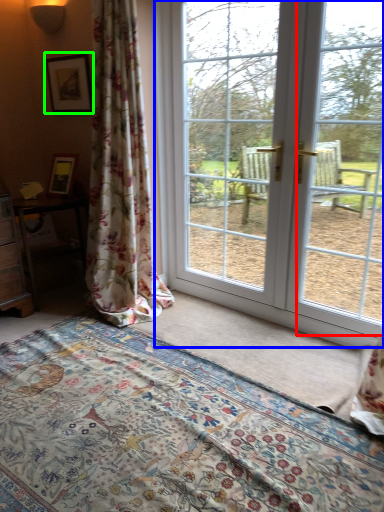
Question: Estimate the real-world distances between objects in this image. Which object is closer to window screen (highlighted by a red box), door (highlighted by a blue box) or picture frame (highlighted by a green box)?

Choices:
 (A) door
 (B) picture frame

Answer: (A)